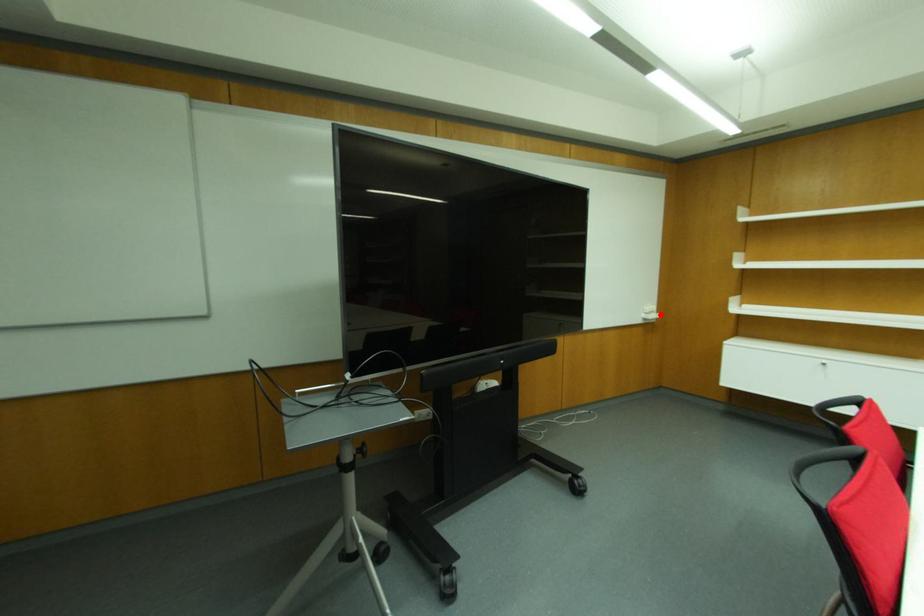
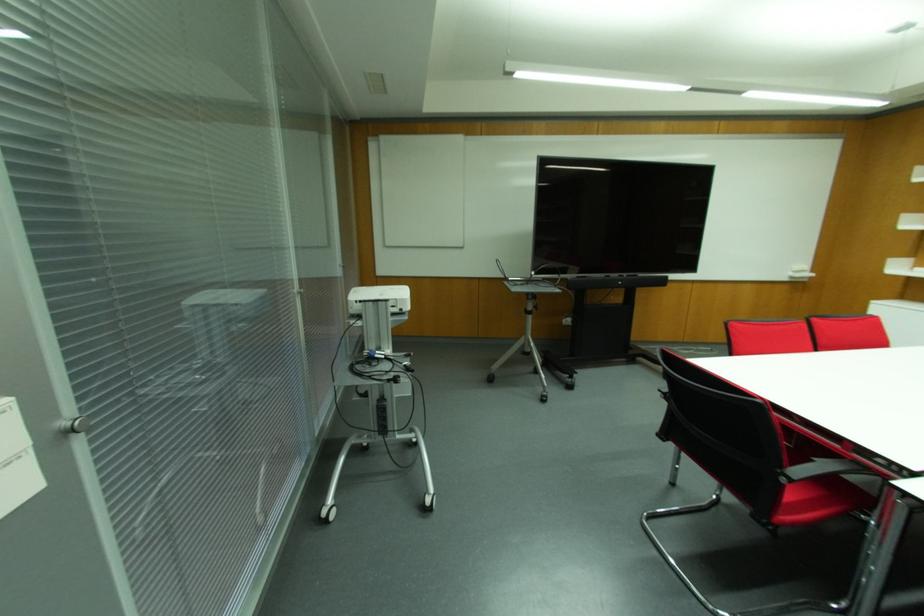
Where in the second image is the point corresponding to the highlighted location from the first image?

(811, 274)